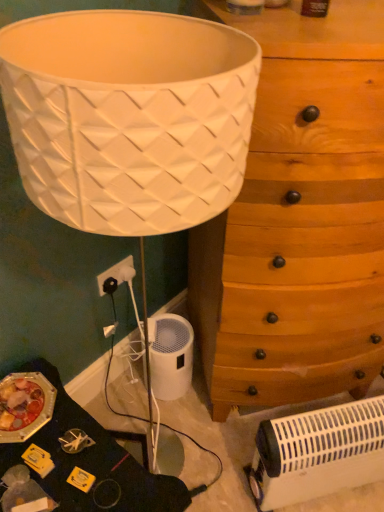
Question: Can you confirm if white plastic heater at lower right is bigger than wooden chest of drawers at center-right?

Choices:
 (A) yes
 (B) no

Answer: (B)

Question: From the image's perspective, would you say white plastic heater at lower right is positioned over wooden chest of drawers at center-right?

Choices:
 (A) no
 (B) yes

Answer: (A)

Question: Is white plastic heater at lower right positioned beyond the bounds of wooden chest of drawers at center-right?

Choices:
 (A) no
 (B) yes

Answer: (B)

Question: Can you confirm if white plastic heater at lower right is positioned to the left of wooden chest of drawers at center-right?

Choices:
 (A) no
 (B) yes

Answer: (A)

Question: From a real-world perspective, is white plastic heater at lower right on top of wooden chest of drawers at center-right?

Choices:
 (A) no
 (B) yes

Answer: (A)

Question: From their relative heights in the image, would you say wooden chest of drawers at center-right is taller or shorter than white plastic electric outlet at lower left?

Choices:
 (A) tall
 (B) short

Answer: (A)

Question: Considering the positions of wooden chest of drawers at center-right and white plastic electric outlet at lower left in the image, is wooden chest of drawers at center-right wider or thinner than white plastic electric outlet at lower left?

Choices:
 (A) wide
 (B) thin

Answer: (A)

Question: Is wooden chest of drawers at center-right inside or outside of white plastic electric outlet at lower left?

Choices:
 (A) outside
 (B) inside

Answer: (A)

Question: Based on their positions, is wooden chest of drawers at center-right located to the left or right of white plastic electric outlet at lower left?

Choices:
 (A) left
 (B) right

Answer: (B)

Question: From their relative heights in the image, would you say wooden chest of drawers at center-right is taller or shorter than white plastic heater at lower right?

Choices:
 (A) tall
 (B) short

Answer: (A)

Question: Looking at the image, does wooden chest of drawers at center-right seem bigger or smaller compared to white plastic heater at lower right?

Choices:
 (A) small
 (B) big

Answer: (B)

Question: In the image, is wooden chest of drawers at center-right positioned in front of or behind white plastic heater at lower right?

Choices:
 (A) front
 (B) behind

Answer: (A)

Question: In terms of width, does wooden chest of drawers at center-right look wider or thinner when compared to white plastic heater at lower right?

Choices:
 (A) thin
 (B) wide

Answer: (B)

Question: From the image's perspective, is white plastic heater at lower right positioned above or below white plastic electric outlet at lower left?

Choices:
 (A) below
 (B) above

Answer: (A)

Question: Does point (286, 498) appear closer or farther from the camera than point (112, 266)?

Choices:
 (A) farther
 (B) closer

Answer: (B)